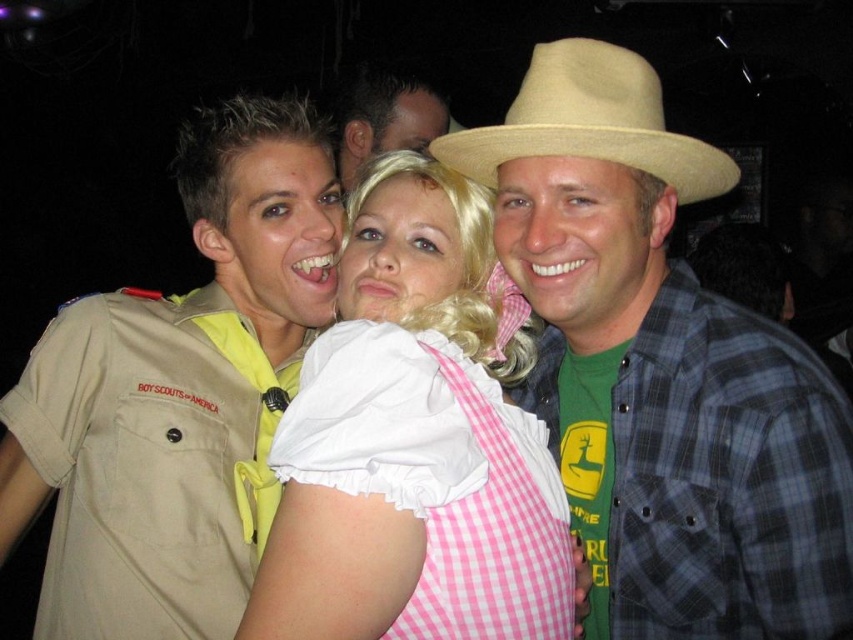
You are a photographer at a party and want to take a group photo of the pink gingham dress at center and the matte black shirt at center. If you want to ensure both are fully visible in the frame, which one should you focus on first?

The pink gingham dress at center has a greater height compared to matte black shirt at center, so you should focus on the pink gingham dress at center first to ensure it is fully visible in the frame.

You are standing in front of the image and want to touch the two points labeled as point (570, 412) and point (602, 84). Which point is closer to your hand when you reach out?

Point (570, 412) is closer to your hand because it is further to the camera than point (602, 84), meaning it is physically nearer to the viewer.

You are at the entrance of the venue and want to locate the pink gingham dress at center. Based on the coordinates provided in the scene description, in which general direction should you look to find it?

The pink gingham dress at center is located at point (416, 440), which corresponds to the central area of the image. Therefore, you should look towards the center of the scene to find it.